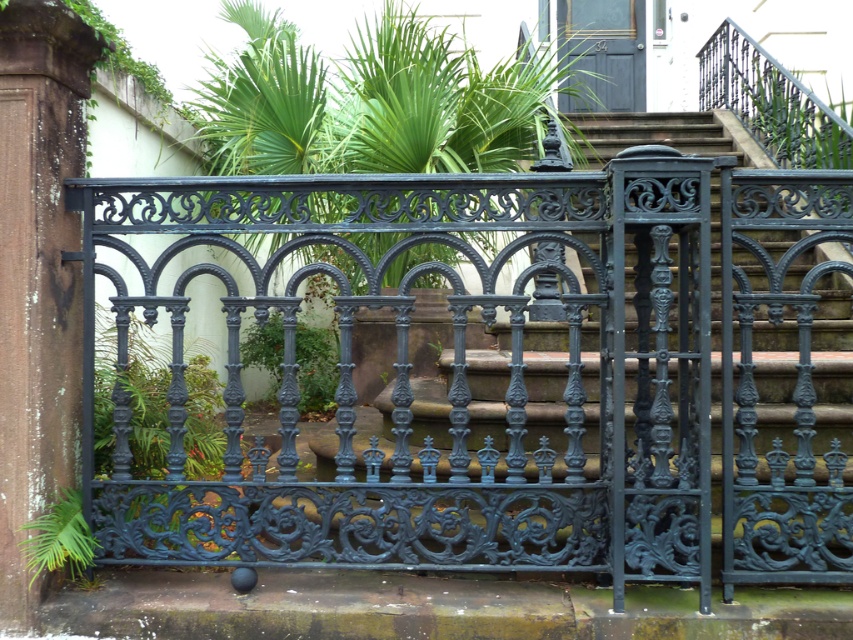
You are standing in front of the ornate black wrought iron fence. You notice a point marked at coordinates (38, 275). Based on the scene description, can you determine what this point is located on?

The point at (38, 275) is located on the green mossy stone pillar at left.

You are standing in front of the ornate black wrought iron fence and notice the green mossy stone pillar at left and the green leafy plant at lower left. Which object is closer to you?

The green mossy stone pillar at left is closer to you because it is in front of the green leafy plant at lower left.